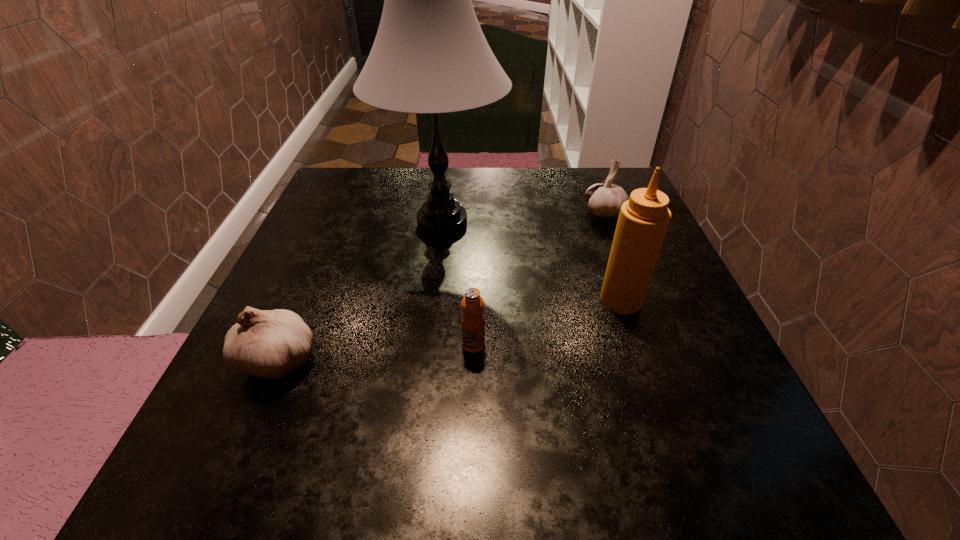
Where is `vacant area situated on the back of the left garlic`? This screenshot has width=960, height=540. vacant area situated on the back of the left garlic is located at coordinates (324, 251).

I want to click on blank area located on the front label of the orange juice, so click(x=473, y=386).

Where is `lamp that is at the far edge`? lamp that is at the far edge is located at coordinates (430, 56).

Locate an element on the screen. The image size is (960, 540). garlic positioned at the far edge is located at coordinates (604, 200).

Find the location of a particular element. lamp that is at the left edge is located at coordinates (430, 56).

Identify the location of garlic that is at the left edge. The image size is (960, 540). (269, 344).

Locate an element on the screen. condiment located at the right edge is located at coordinates [643, 221].

Where is `garlic located at the right edge`? garlic located at the right edge is located at coordinates (604, 200).

Where is `object located in the far left corner section of the desktop`? object located in the far left corner section of the desktop is located at coordinates (430, 56).

The height and width of the screenshot is (540, 960). Identify the location of object that is at the far right corner. (604, 200).